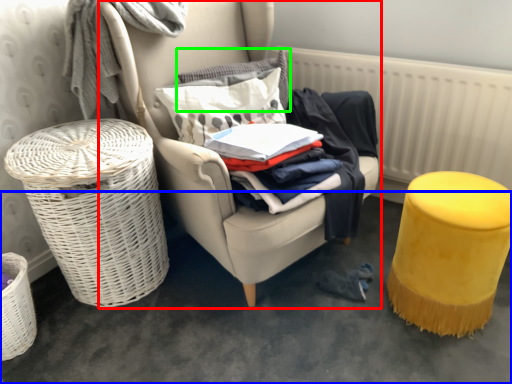
Question: Considering the real-world distances, which object is closest to chair (highlighted by a red box)? concrete (highlighted by a blue box) or pillow (highlighted by a green box).

Choices:
 (A) concrete
 (B) pillow

Answer: (B)